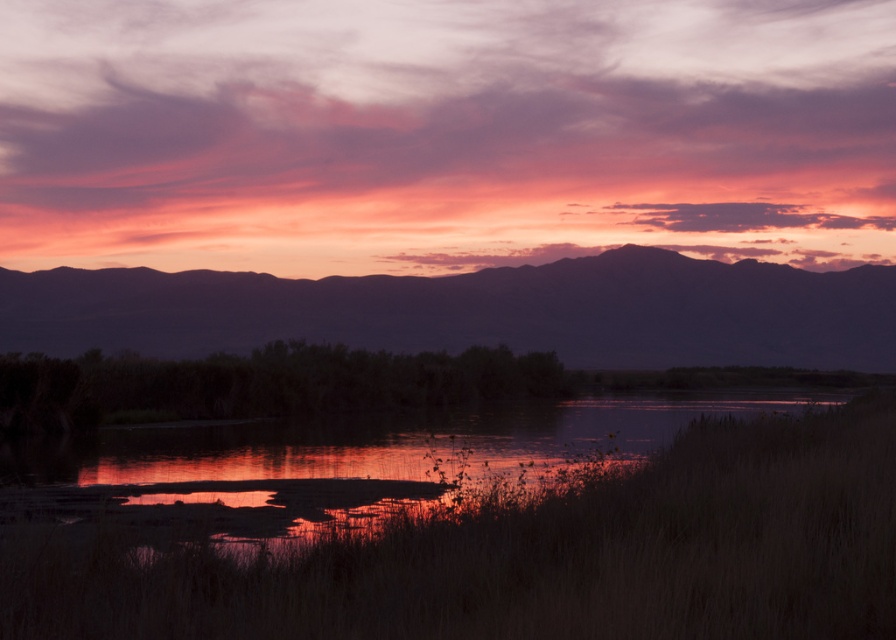
Between silvery metallic mountain at upper center and reflective wetland at center, which one is positioned higher?

silvery metallic mountain at upper center is higher up.

Is silvery metallic mountain at upper center smaller than reflective wetland at center?

Actually, silvery metallic mountain at upper center might be larger than reflective wetland at center.

Identify the location of silvery metallic mountain at upper center. This screenshot has height=640, width=896. (477, 310).

Find the location of a particular element. silvery metallic mountain at upper center is located at coordinates (477, 310).